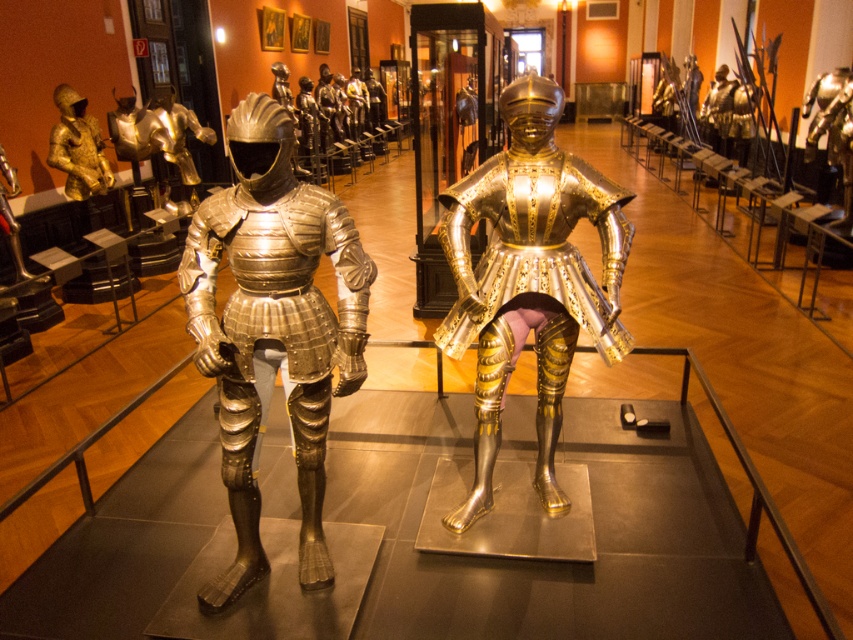
Question: Which object is the closest to the gold plated armor at center?

Choices:
 (A) shiny silver armor at center
 (B) gold plated armor at left

Answer: (B)

Question: Can you confirm if polished silver armor at center is bigger than gold plated armor at left?

Choices:
 (A) yes
 (B) no

Answer: (A)

Question: Can you confirm if polished silver armor at center is thinner than gold plated armor at left?

Choices:
 (A) no
 (B) yes

Answer: (A)

Question: Does polished silver armor at center appear on the left side of shiny silver armor at center?

Choices:
 (A) yes
 (B) no

Answer: (B)

Question: Based on their relative distances, which object is nearer to the polished silver armor at center?

Choices:
 (A) gold plated armor at center
 (B) shiny silver armor at center
 (C) gold plated armor at left

Answer: (A)

Question: Which object is closer to the camera taking this photo?

Choices:
 (A) polished silver armor at center
 (B) gold plated armor at center
 (C) shiny silver armor at center

Answer: (A)